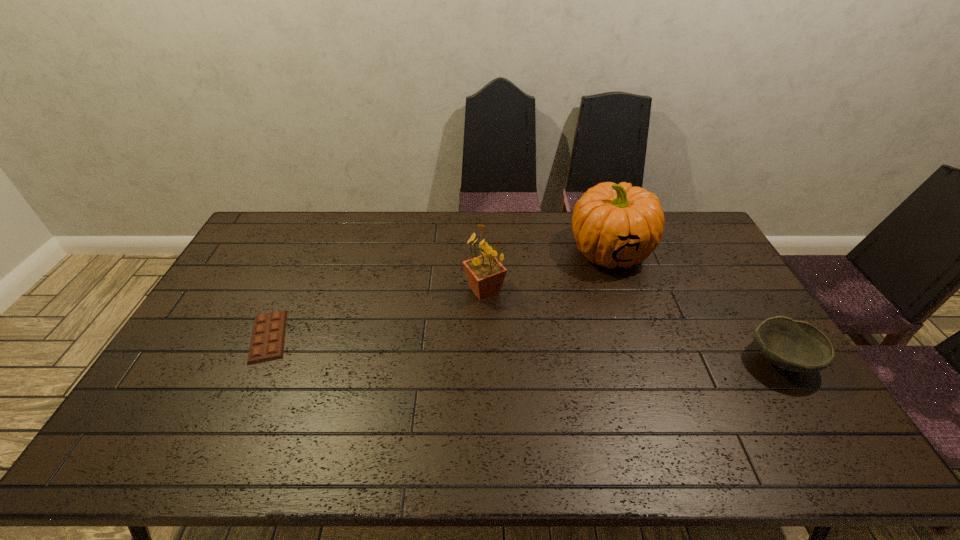
In the image, there is a desktop. Where is `blank space at the left edge`? blank space at the left edge is located at coordinates pos(218,299).

Where is `vacant space at the right edge of the desktop`? vacant space at the right edge of the desktop is located at coordinates (700, 282).

Locate an element on the screen. This screenshot has height=540, width=960. free space between the leftmost object and the rightmost object is located at coordinates (524, 348).

I want to click on vacant area that lies between the bowl and the second object from left to right, so click(x=633, y=325).

Locate an element on the screen. vacant area that lies between the chocolate bar and the second object from left to right is located at coordinates (376, 314).

Where is `free point between the leftmost object and the bowl`? This screenshot has height=540, width=960. free point between the leftmost object and the bowl is located at coordinates (524, 348).

Locate an element on the screen. The width and height of the screenshot is (960, 540). free spot between the leftmost object and the pumpkin is located at coordinates (439, 294).

Find the location of a particular element. Image resolution: width=960 pixels, height=540 pixels. free space between the pumpkin and the bowl is located at coordinates (695, 306).

You are a GUI agent. You are given a task and a screenshot of the screen. Output one action in this format:
    pyautogui.click(x=<x>, y=<y>)
    Task: Click on the empty space that is in between the third object from right to left and the second object from right to left
    The height and width of the screenshot is (540, 960).
    Given the screenshot: What is the action you would take?
    pyautogui.click(x=547, y=271)

Identify the location of vacant region between the sunflower and the chocolate bar. (376, 314).